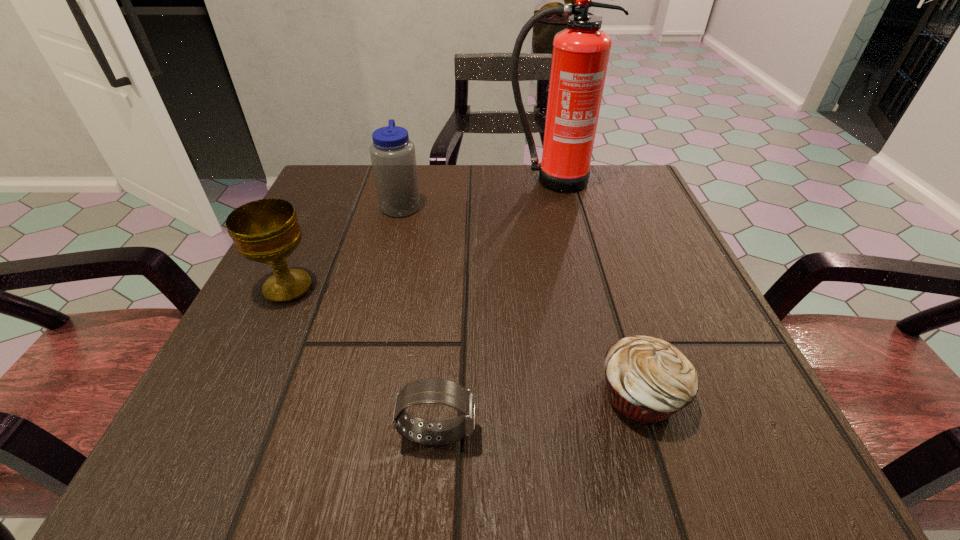
Locate an element on the screen. This screenshot has width=960, height=540. object that is positioned at the far right corner is located at coordinates 580,55.

Where is `object at the near right corner`? The image size is (960, 540). object at the near right corner is located at coordinates (647, 379).

Locate an element on the screen. This screenshot has height=540, width=960. vacant region at the far edge is located at coordinates (514, 187).

The image size is (960, 540). In the image, there is a desktop. Identify the location of vacant space at the near edge. point(553,449).

The width and height of the screenshot is (960, 540). I want to click on vacant area at the left edge of the desktop, so click(x=348, y=288).

Where is `vacant area at the right edge`? The image size is (960, 540). vacant area at the right edge is located at coordinates (594, 233).

Where is `vacant space at the far right corner`? The width and height of the screenshot is (960, 540). vacant space at the far right corner is located at coordinates (585, 191).

Image resolution: width=960 pixels, height=540 pixels. Identify the location of vacant space at the near right corner of the desktop. (662, 430).

Where is `vacant area that lies between the muffin and the leftmost object`? vacant area that lies between the muffin and the leftmost object is located at coordinates (464, 341).

Locate an element on the screen. This screenshot has height=540, width=960. empty space between the watch and the tallest object is located at coordinates (494, 307).